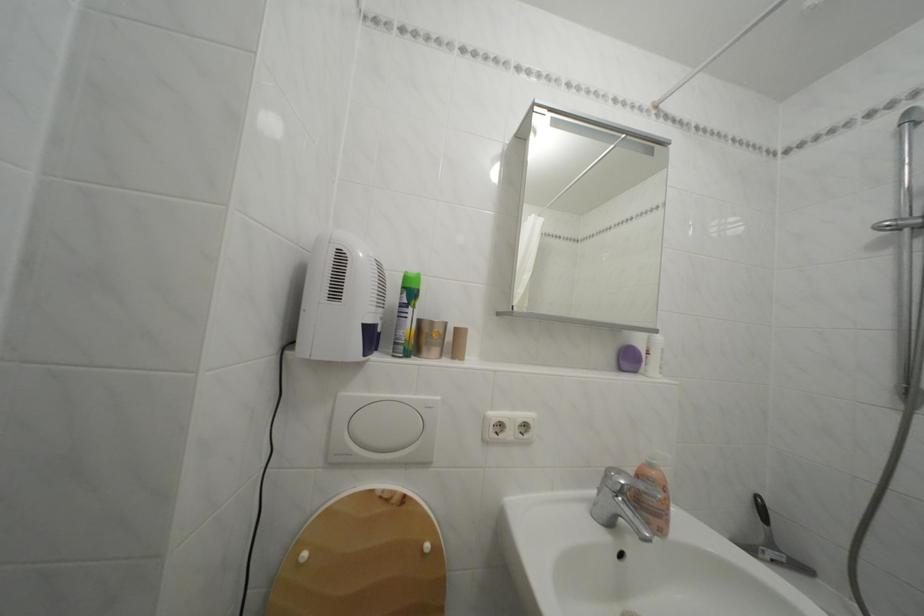
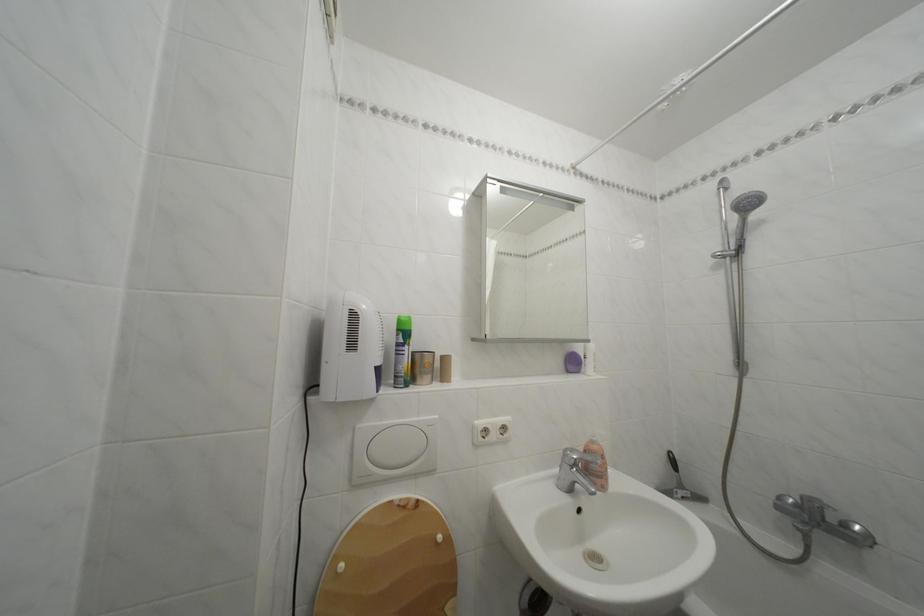
Find the pixel in the second image that matches (x=350, y=400) in the first image.

(368, 432)